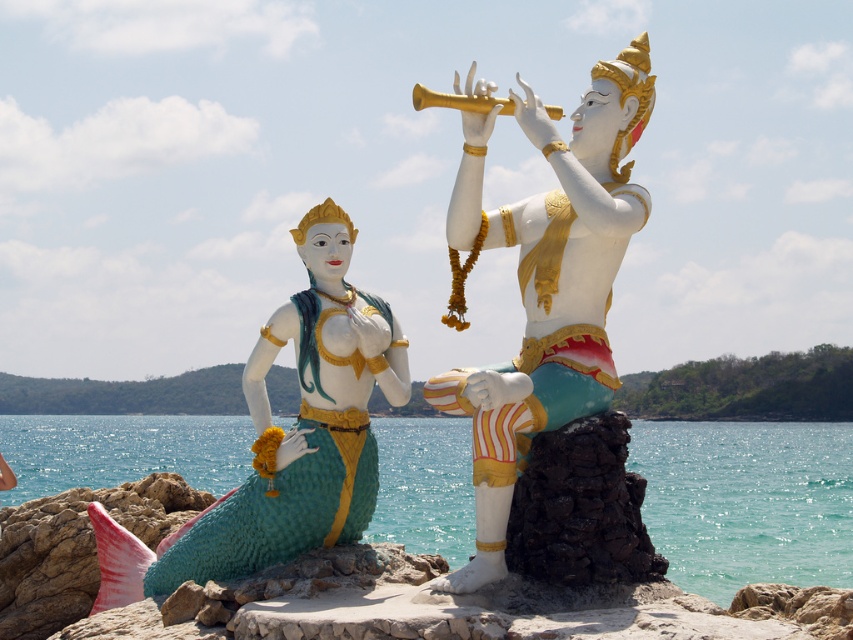
Who is more forward, (669, 509) or (317, 321)?

Point (317, 321) is in front.

Locate an element on the screen. Image resolution: width=853 pixels, height=640 pixels. teal glossy water at lower center is located at coordinates (747, 500).

Is point (279, 432) less distant than point (436, 100)?

No, (279, 432) is behind (436, 100).

Identify the location of matte green mermaid statue at left. [285, 436].

Which is below, white glossy statue at center or gold metallic trumpet at upper center?

white glossy statue at center is below.

Between white glossy statue at center and gold metallic trumpet at upper center, which one has less height?

With less height is gold metallic trumpet at upper center.

Image resolution: width=853 pixels, height=640 pixels. I want to click on white glossy statue at center, so click(x=546, y=284).

Where is `white glossy statue at center`? white glossy statue at center is located at coordinates (546, 284).